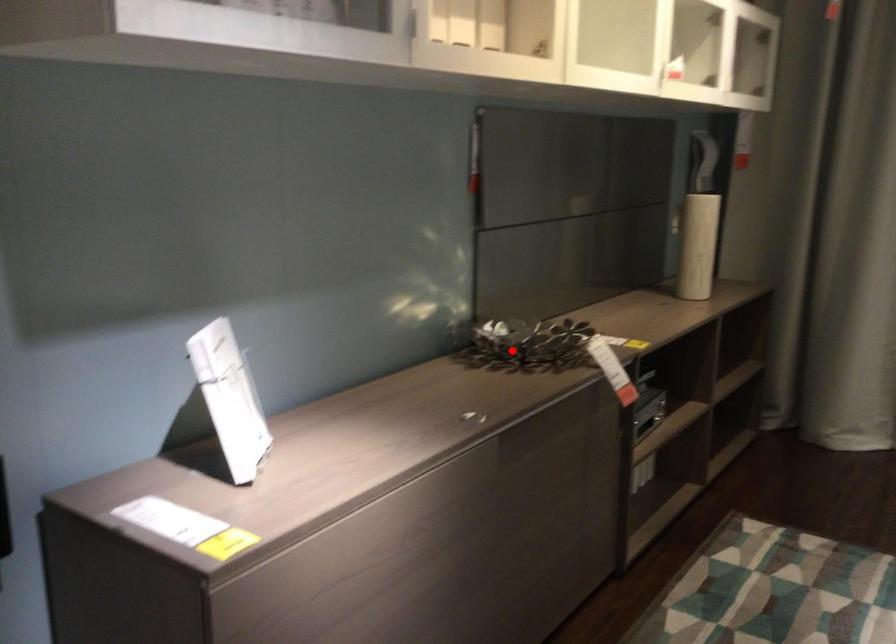
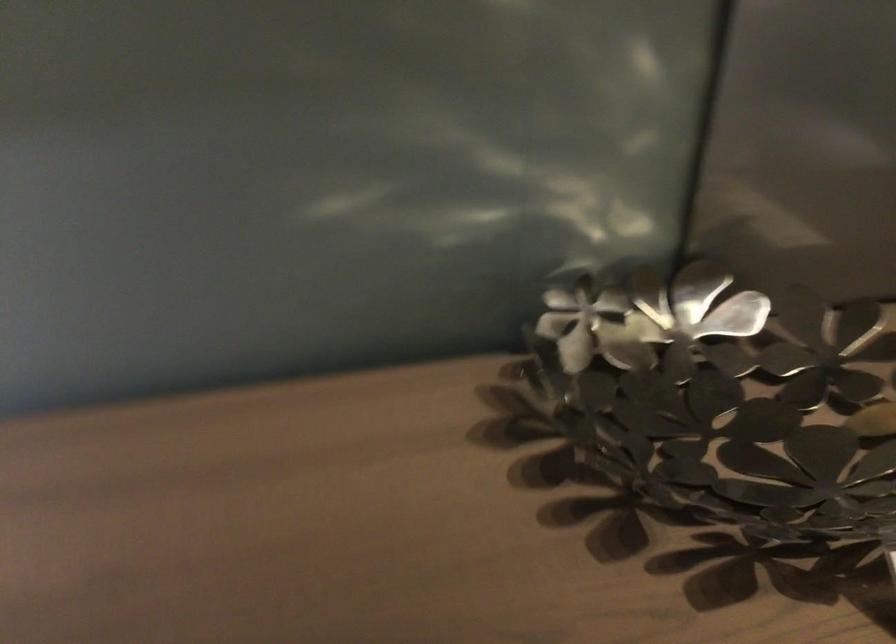
Find the pixel in the second image that matches the highlighted location in the first image.

(721, 399)